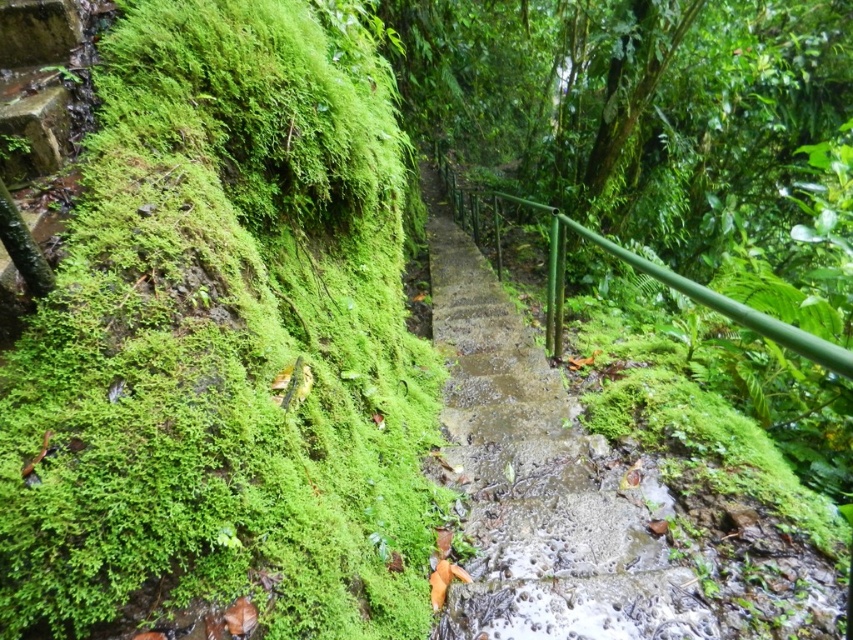
Looking at this image, you are standing at the bottom of the staircase in the jungle. You see two points marked on the staircase. Which point is closer to you, point (213,28) or point (553,316)?

Point (213,28) is closer to the viewer than point (553,316).

You are hiking through a jungle and come across a staircase. You need to step onto the green concrete stairs at center. To your left, there is a green mossy rock at left. Which direction should you move to reach the stairs?

You should move to the right because the green mossy rock at left is to the left of the green concrete stairs at center, so moving right will bring you towards the stairs.